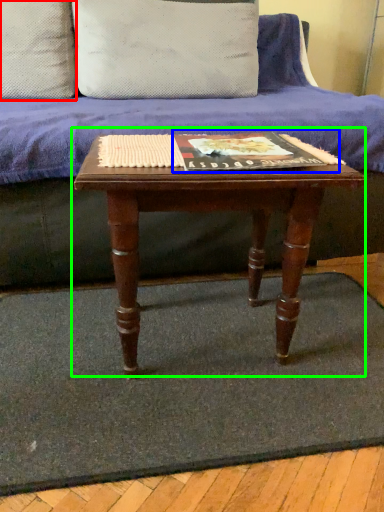
Question: Estimate the real-world distances between objects in this image. Which object is farther from pillow (highlighted by a red box), paperback book (highlighted by a blue box) or table (highlighted by a green box)?

Choices:
 (A) paperback book
 (B) table

Answer: (B)